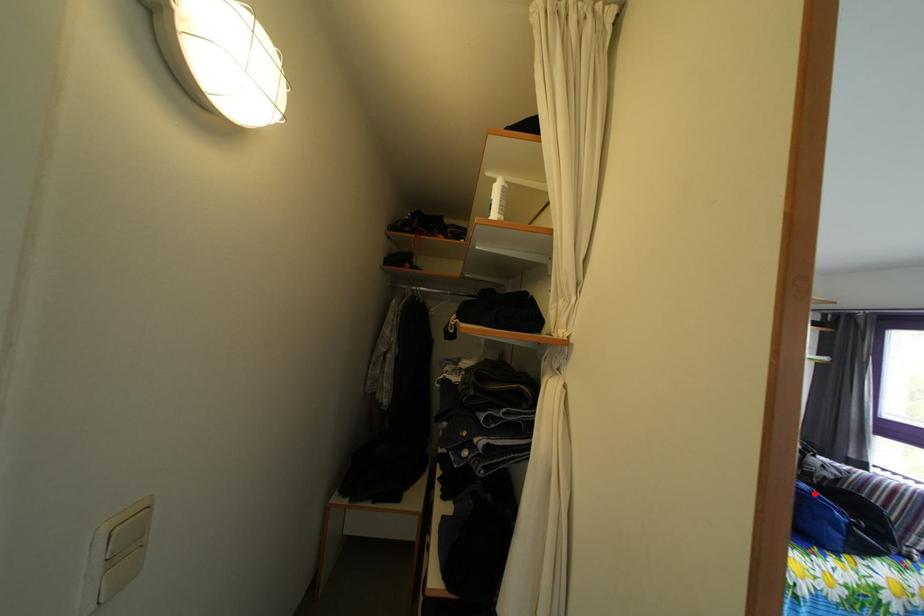
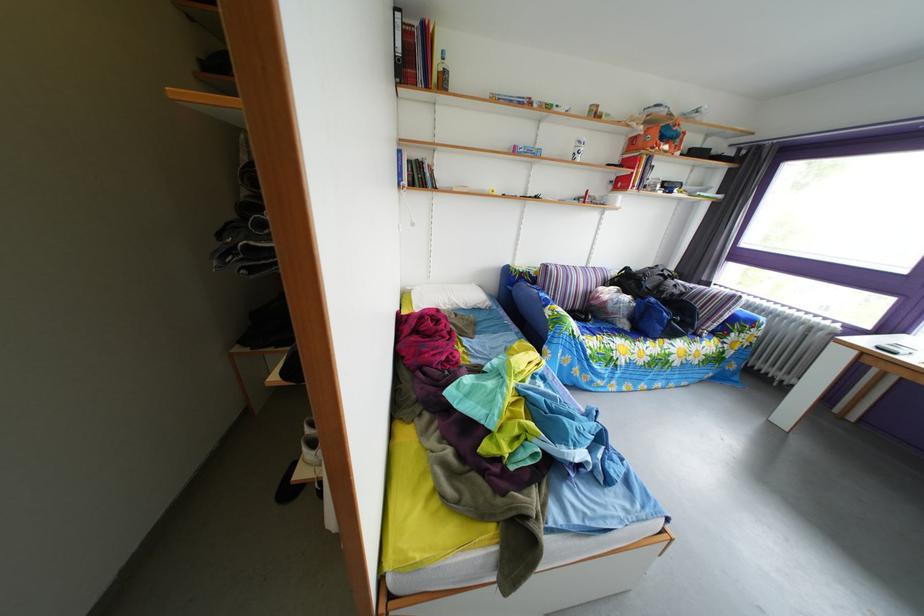
Find the pixel in the second image that matches the highlighted location in the first image.

(663, 307)